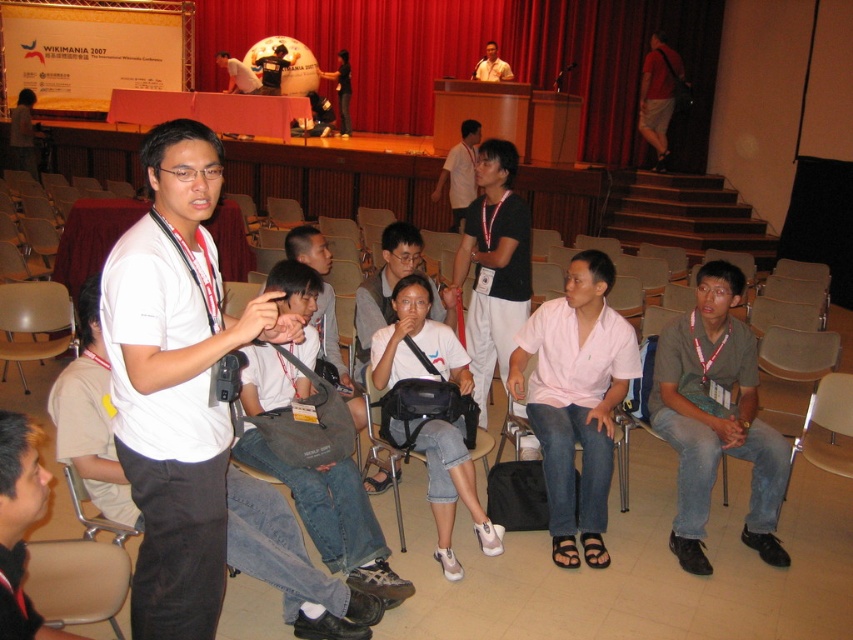
Question: Which object is farther from the camera taking this photo?

Choices:
 (A) matte white shirt at center
 (B) white matte shirt at center

Answer: (A)

Question: Does pink cotton shirt at center appear on the left side of denim jeans at center?

Choices:
 (A) no
 (B) yes

Answer: (A)

Question: Based on their relative distances, which object is nearer to the dark gray jeans at lower right?

Choices:
 (A) white matte shirt at center
 (B) beige plastic chair at lower left
 (C) red fabric bag at upper right
 (D) dark brown leather jacket at lower left

Answer: (A)

Question: Which object is the closest to the white matte shirt at center?

Choices:
 (A) beige leather chair at lower left
 (B) red fabric bag at upper right

Answer: (A)

Question: Is dark brown leather jacket at lower left wider than red fabric bag at upper right?

Choices:
 (A) yes
 (B) no

Answer: (B)

Question: Is denim jeans at center smaller than matte white shirt at center?

Choices:
 (A) yes
 (B) no

Answer: (B)